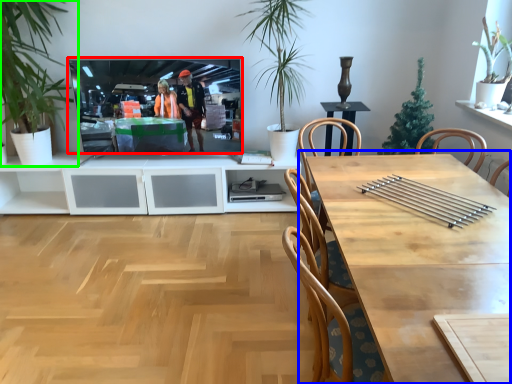
Question: Estimate the real-world distances between objects in this image. Which object is farther from television (highlighted by a red box), table (highlighted by a blue box) or houseplant (highlighted by a green box)?

Choices:
 (A) table
 (B) houseplant

Answer: (A)